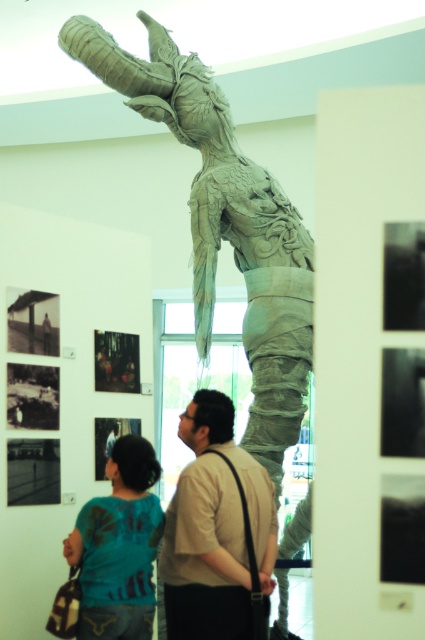
Is point (244, 220) more distant than point (218, 576)?

Yes, point (244, 220) is farther from viewer.

Looking at this image, can you confirm if carved wood dragon at center is wider than light brown leather shirt at center?

Indeed, carved wood dragon at center has a greater width compared to light brown leather shirt at center.

Is point (164, 97) positioned behind point (269, 573)?

Yes, it is.

Where is `carved wood dragon at center`? This screenshot has height=640, width=425. carved wood dragon at center is located at coordinates (226, 225).

How distant is light brown leather shirt at center from teal fabric shirt at lower left?

The distance of light brown leather shirt at center from teal fabric shirt at lower left is 12.63 inches.

Which is more to the right, light brown leather shirt at center or teal fabric shirt at lower left?

Positioned to the right is light brown leather shirt at center.

Which is in front, point (197, 515) or point (113, 621)?

Point (197, 515) is more forward.

At what (x,y) coordinates should I click in order to perform the action: click on light brown leather shirt at center. Please return your answer as a coordinate pair (x, y). Looking at the image, I should click on (215, 529).

Is point (138, 93) farther from camera compared to point (141, 609)?

Yes.

Measure the distance between carved wood dragon at center and teal fabric shirt at lower left.

carved wood dragon at center and teal fabric shirt at lower left are 4.95 feet apart.

Who is more distant from viewer, [280,224] or [104,604]?

The point [280,224] is behind.

This screenshot has width=425, height=640. Find the location of `carved wood dragon at center`. carved wood dragon at center is located at coordinates (226, 225).